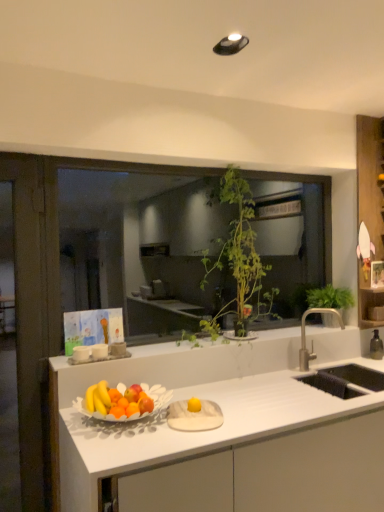
In order to face wooden shelf at right, should I rotate leftwards or rightwards?

Turn right by 23.670 degrees to look at wooden shelf at right.

Measure the distance between point (228,257) and camera.

8.62 feet.

This screenshot has height=512, width=384. Describe the element at coordinates (227, 431) in the screenshot. I see `white matte countertop at center` at that location.

Identify the location of silver metallic faucet at right. (312, 341).

Looking at their sizes, would you say silver metallic faucet at right is wider or thinner than green leafy plant at upper right, placed as the 2th houseplant when sorted from left to right?

Clearly, silver metallic faucet at right has less width compared to green leafy plant at upper right, placed as the 2th houseplant when sorted from left to right.

Is silver metallic faucet at right at the right side of green leafy plant at upper right, which appears as the 1th houseplant when viewed from the right?

In fact, silver metallic faucet at right is to the left of green leafy plant at upper right, which appears as the 1th houseplant when viewed from the right.

In the image, is silver metallic faucet at right positioned in front of or behind green leafy plant at upper right, placed as the 2th houseplant when sorted from left to right?

silver metallic faucet at right is in front of green leafy plant at upper right, placed as the 2th houseplant when sorted from left to right.

From a real-world perspective, is silver metallic faucet at right positioned under green leafy plant at upper right, placed as the 2th houseplant when sorted from left to right, based on gravity?

Indeed, from a real-world perspective, silver metallic faucet at right is positioned beneath green leafy plant at upper right, placed as the 2th houseplant when sorted from left to right.

From a real-world perspective, is green leafy plant at upper right, placed as the 2th houseplant when sorted from left to right, physically above green leafy plant at center, which is counted as the 2th houseplant, starting from the right?

No.

This screenshot has height=512, width=384. Find the location of `houseplant on the left of the green leafy plant at upper right, which appears as the 1th houseplant when viewed from the right`. houseplant on the left of the green leafy plant at upper right, which appears as the 1th houseplant when viewed from the right is located at coordinates (238, 260).

Is green leafy plant at upper right, which appears as the 1th houseplant when viewed from the right, not close to green leafy plant at center, which is counted as the 2th houseplant, starting from the right?

No, green leafy plant at upper right, which appears as the 1th houseplant when viewed from the right, is not far away from green leafy plant at center, which is counted as the 2th houseplant, starting from the right.

Can you tell me how much green leafy plant at upper right, placed as the 2th houseplant when sorted from left to right, and green leafy plant at center, which is counted as the 2th houseplant, starting from the right, differ in facing direction?

There is a 0.00251-degree angle between the facing directions of green leafy plant at upper right, placed as the 2th houseplant when sorted from left to right, and green leafy plant at center, which is counted as the 2th houseplant, starting from the right.

Does white matte countertop at center touch green leafy plant at center?

white matte countertop at center is not next to green leafy plant at center, and they're not touching.

From a real-world perspective, is white matte countertop at center over green leafy plant at center?

No, from a real-world perspective, white matte countertop at center is not on top of green leafy plant at center.

Where is `countertop below the green leafy plant at center (from the image's perspective)`? countertop below the green leafy plant at center (from the image's perspective) is located at coordinates (227, 431).

Is white matte countertop at center facing away from green leafy plant at center?

No, white matte countertop at center is not facing away from green leafy plant at center.

Which is nearer, (x=337, y=489) or (x=305, y=312)?

The point (x=337, y=489) is closer to the camera.

Is white matte countertop at center placed right next to silver metallic faucet at right?

No, white matte countertop at center is not next to silver metallic faucet at right.

Is white matte countertop at center oriented away from silver metallic faucet at right?

white matte countertop at center does not have its back to silver metallic faucet at right.

From a real-world perspective, is white matte countertop at center positioned above or below silver metallic faucet at right?

From a real-world perspective, white matte countertop at center is physically below silver metallic faucet at right.

Who is shorter, silver metallic faucet at right or matte white bowl of fruits at center?

matte white bowl of fruits at center is shorter.

Is silver metallic faucet at right inside the boundaries of matte white bowl of fruits at center, or outside?

The correct answer is: outside.

Does silver metallic faucet at right have a smaller size compared to matte white bowl of fruits at center?

Correct, silver metallic faucet at right occupies less space than matte white bowl of fruits at center.

Is green leafy plant at center placed right next to white matte countertop at center?

No, green leafy plant at center is not making contact with white matte countertop at center.

Do you think green leafy plant at center is within white matte countertop at center, or outside of it?

The correct answer is: outside.

Which object is positioned more to the right, green leafy plant at center or white matte countertop at center?

white matte countertop at center.

Is green leafy plant at center turned away from white matte countertop at center?

No, green leafy plant at center is not facing the opposite direction of white matte countertop at center.

Who is smaller, green leafy plant at center or green leafy plant at upper right, which appears as the 1th houseplant when viewed from the right?

Smaller between the two is green leafy plant at upper right, which appears as the 1th houseplant when viewed from the right.

From a real-world perspective, is green leafy plant at center positioned over green leafy plant at upper right, which appears as the 1th houseplant when viewed from the right, based on gravity?

Yes.

Can you confirm if green leafy plant at center is wider than green leafy plant at upper right, placed as the 2th houseplant when sorted from left to right?

No, green leafy plant at center is not wider than green leafy plant at upper right, placed as the 2th houseplant when sorted from left to right.

Find the location of `tap below the green leafy plant at upper right, placed as the 2th houseplant when sorted from left to right (from a real-world perspective)`. tap below the green leafy plant at upper right, placed as the 2th houseplant when sorted from left to right (from a real-world perspective) is located at coordinates (312, 341).

The image size is (384, 512). I want to click on houseplant behind the green leafy plant at center, which is counted as the 2th houseplant, starting from the right, so click(330, 298).

Which object lies further to the anchor point wooden shelf at right, green leafy plant at center, the first houseplant in the left-to-right sequence, or green leafy plant at upper right, placed as the 2th houseplant when sorted from left to right?

The object further to wooden shelf at right is green leafy plant at center, the first houseplant in the left-to-right sequence.

Looking at the image, which one is located closer to white matte countertop at center, wooden shelf at right or green leafy plant at center?

wooden shelf at right is closer to white matte countertop at center.

Looking at the image, which one is located further to wooden shelf at right, white matte countertop at center or green leafy plant at center, the first houseplant in the left-to-right sequence?

The object further to wooden shelf at right is white matte countertop at center.

Looking at the image, which one is located closer to silver metallic faucet at right, green leafy plant at upper right, which appears as the 1th houseplant when viewed from the right, or matte white bowl of fruits at center?

green leafy plant at upper right, which appears as the 1th houseplant when viewed from the right, is positioned closer to the anchor silver metallic faucet at right.

Which object lies nearer to the anchor point green leafy plant at center, wooden shelf at right or white matte countertop at center?

white matte countertop at center.

When comparing their distances from green leafy plant at center, which is counted as the 2th houseplant, starting from the right, does silver metallic faucet at right or matte white bowl of fruits at center seem further?

matte white bowl of fruits at center.

Considering their positions, is green leafy plant at center positioned further to green leafy plant at center, the first houseplant in the left-to-right sequence, than wooden shelf at right?

Among the two, green leafy plant at center is located further to green leafy plant at center, the first houseplant in the left-to-right sequence.

Which object lies further to the anchor point green leafy plant at center, wooden shelf at right or green leafy plant at center, which is counted as the 2th houseplant, starting from the right?

wooden shelf at right is further to green leafy plant at center.

Find the location of a particular element. tap between green leafy plant at center and white matte countertop at center vertically is located at coordinates (312, 341).

Where is `fruit dish that lies between green leafy plant at center, the first houseplant in the left-to-right sequence, and white matte countertop at center from top to bottom`? The width and height of the screenshot is (384, 512). fruit dish that lies between green leafy plant at center, the first houseplant in the left-to-right sequence, and white matte countertop at center from top to bottom is located at coordinates (128, 405).

I want to click on window between white matte countertop at center and green leafy plant at upper right, placed as the 2th houseplant when sorted from left to right, in the front-back direction, so click(141, 251).

Image resolution: width=384 pixels, height=512 pixels. I want to click on tap between green leafy plant at center, the first houseplant in the left-to-right sequence, and white matte countertop at center vertically, so click(x=312, y=341).